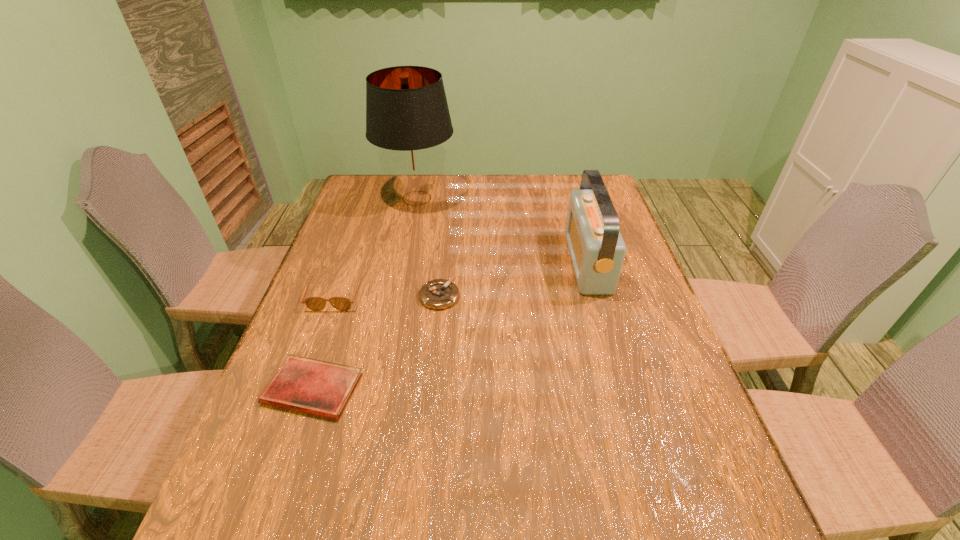
Locate an element on the screen. free space between the shortest object and the third tallest object is located at coordinates (324, 341).

This screenshot has height=540, width=960. Find the location of `vacant point located between the tallest object and the shortest object`. vacant point located between the tallest object and the shortest object is located at coordinates (365, 293).

Locate an element on the screen. The height and width of the screenshot is (540, 960). free spot between the second shortest object and the sunglasses is located at coordinates (388, 295).

Find the location of a particular element. The width and height of the screenshot is (960, 540). vacant area that lies between the ashtray and the radio receiver is located at coordinates (514, 279).

You are a GUI agent. You are given a task and a screenshot of the screen. Output one action in this format:
    pyautogui.click(x=<x>, y=<y>)
    Task: Click on the free space between the farthest object and the diary
    The image size is (960, 540).
    Given the screenshot: What is the action you would take?
    pyautogui.click(x=365, y=293)

The height and width of the screenshot is (540, 960). I want to click on free spot between the rightmost object and the farthest object, so (502, 230).

I want to click on vacant point located between the ashtray and the farthest object, so pos(428,247).

Identify which object is the closest to the fourth tallest object. Please provide its 2D coordinates. Your answer should be formatted as a tuple, i.e. [(x, y)], where the tuple contains the x and y coordinates of a point satisfying the conditions above.

[(313, 303)]

The height and width of the screenshot is (540, 960). Find the location of `object that is the third closest one to the shortest object`. object that is the third closest one to the shortest object is located at coordinates (597, 250).

The image size is (960, 540). Find the location of `vacant area in the image that satisfies the following two spatial constraints: 1. on the front-facing side of the sunglasses; 2. on the right side of the diary`. vacant area in the image that satisfies the following two spatial constraints: 1. on the front-facing side of the sunglasses; 2. on the right side of the diary is located at coordinates (302, 389).